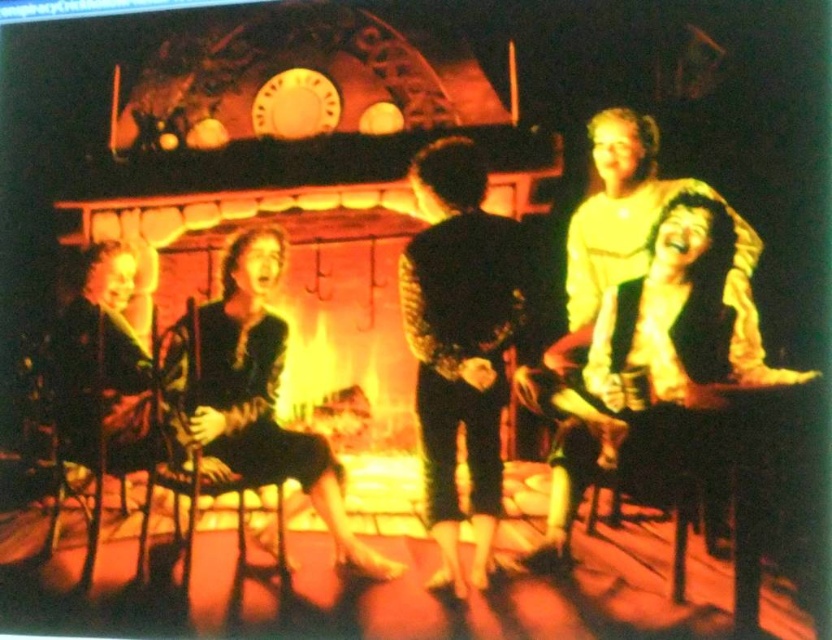
Question: Can you confirm if black textured jacket at center is bigger than wooden table at center?

Choices:
 (A) yes
 (B) no

Answer: (A)

Question: Among these objects, which one is farthest from the camera?

Choices:
 (A) matte black dress at center
 (B) wooden table at center

Answer: (A)

Question: Which point is closer to the camera?

Choices:
 (A) wooden table at center
 (B) black textured jacket at center
 (C) matte black dress at center

Answer: (A)

Question: Does black textured jacket at center have a lesser width compared to matte black dress at center?

Choices:
 (A) yes
 (B) no

Answer: (A)

Question: Does matte black dress at center have a greater width compared to wooden table at center?

Choices:
 (A) no
 (B) yes

Answer: (B)

Question: Which object appears closest to the camera in this image?

Choices:
 (A) black textured jacket at center
 (B) matte black dress at center
 (C) wooden table at center

Answer: (C)